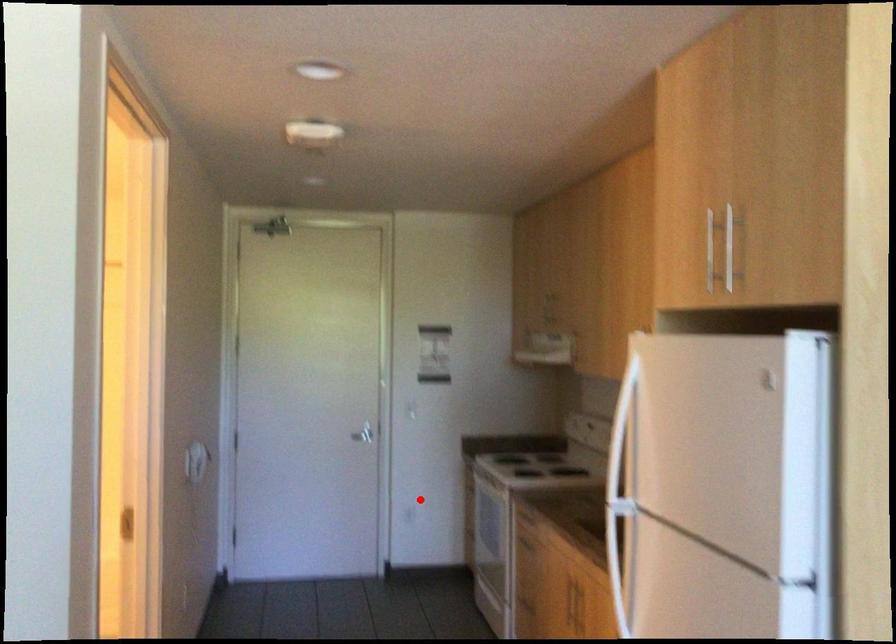
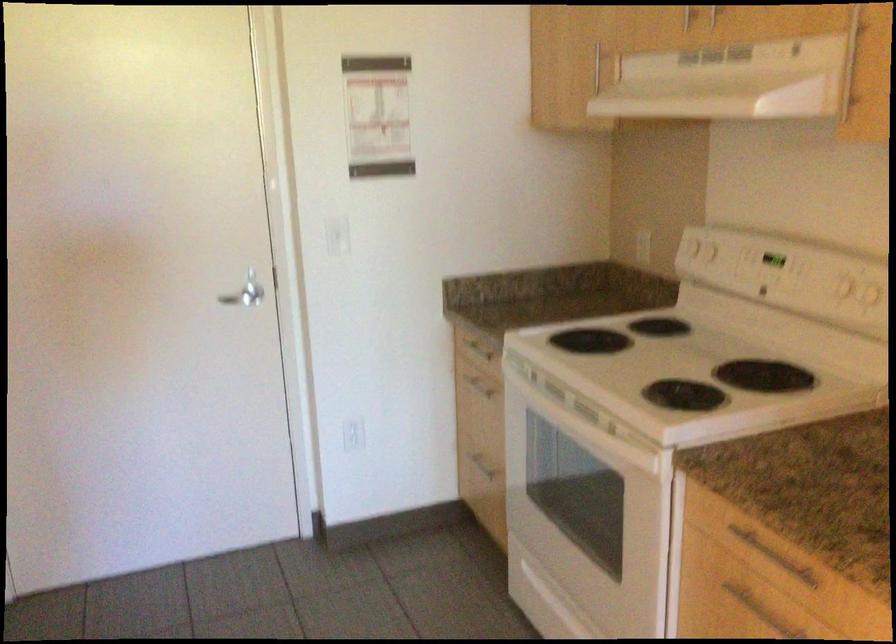
Question: I am providing you with two images of the same scene from different viewpoints. A red point is shown in image1. For the corresponding object point in image2, is it positioned nearer or farther from the camera?

Choices:
 (A) Nearer
 (B) Farther

Answer: (A)